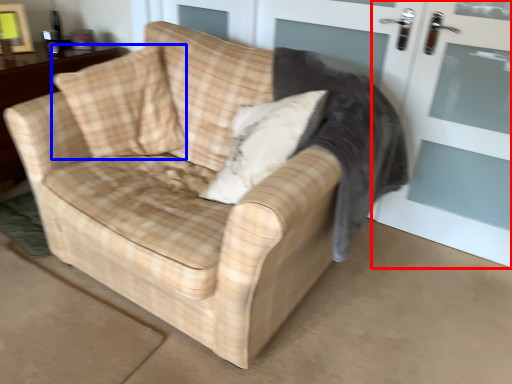
Question: Which of the following is the farthest to the observer, screen door (highlighted by a red box) or throw pillow (highlighted by a blue box)?

Choices:
 (A) screen door
 (B) throw pillow

Answer: (B)